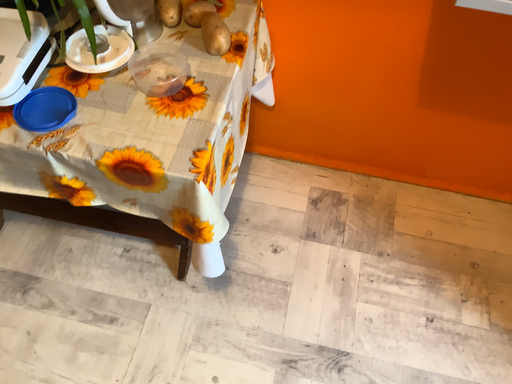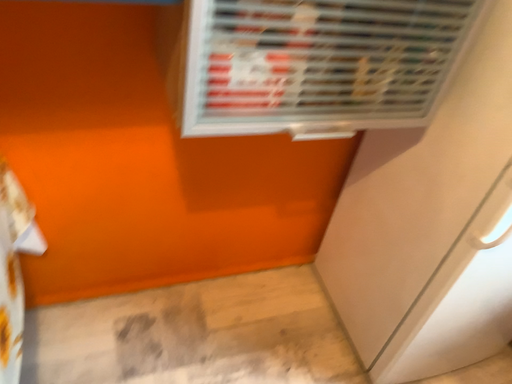
Question: How did the camera likely rotate when shooting the video?

Choices:
 (A) rotated upward
 (B) rotated downward

Answer: (A)